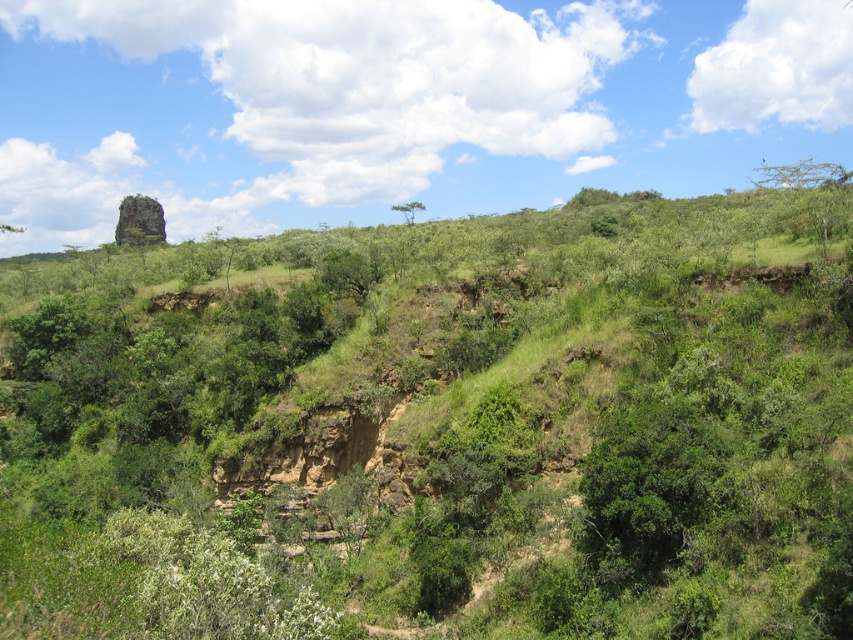
Does green leafy tree at upper right have a greater width compared to green leafy tree at center?

Correct, the width of green leafy tree at upper right exceeds that of green leafy tree at center.

Between point (764, 172) and point (416, 209), which one is positioned in front?

Point (416, 209) is in front.

Identify the location of green leafy tree at upper right. (801, 173).